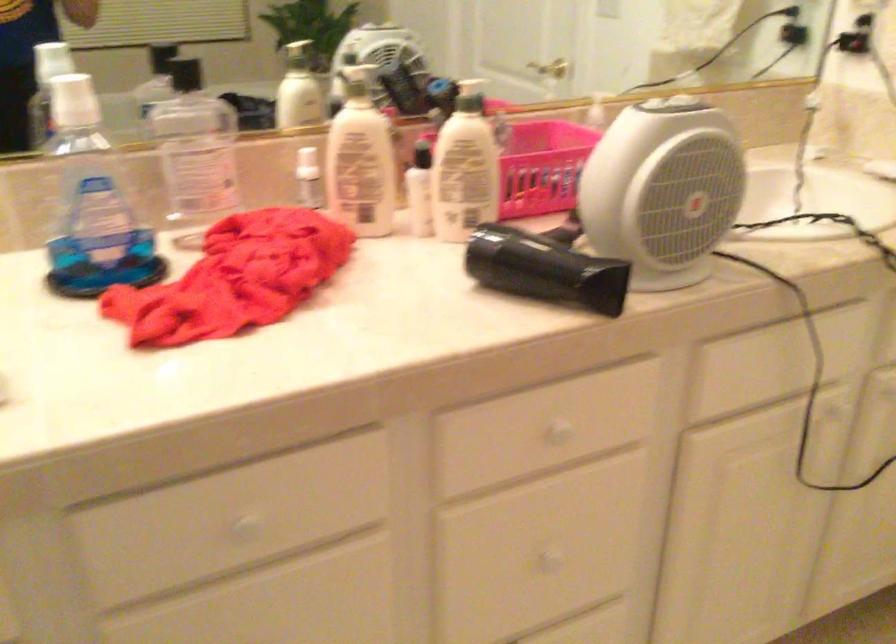
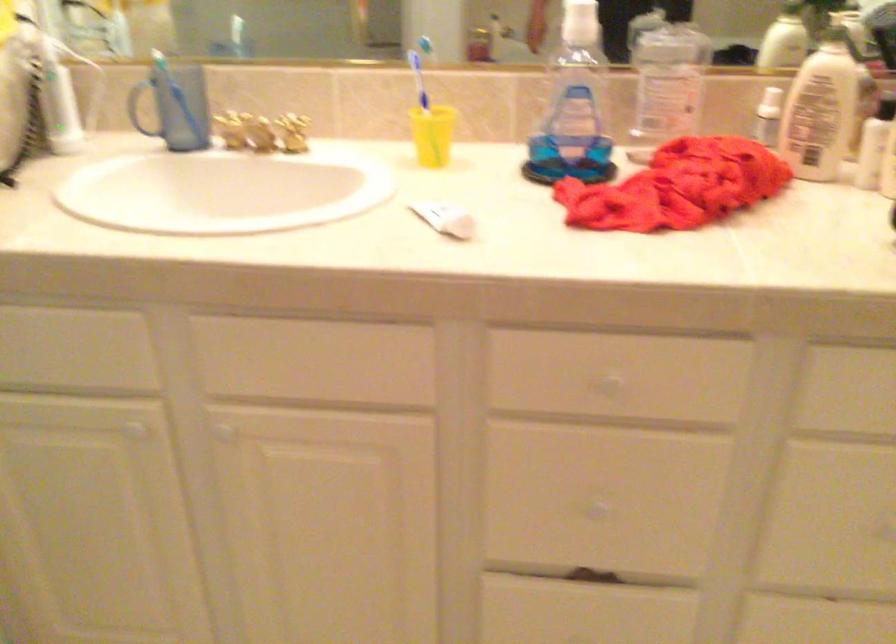
The point at (90,102) is marked in the first image. Where is the corresponding point in the second image?

(583, 24)